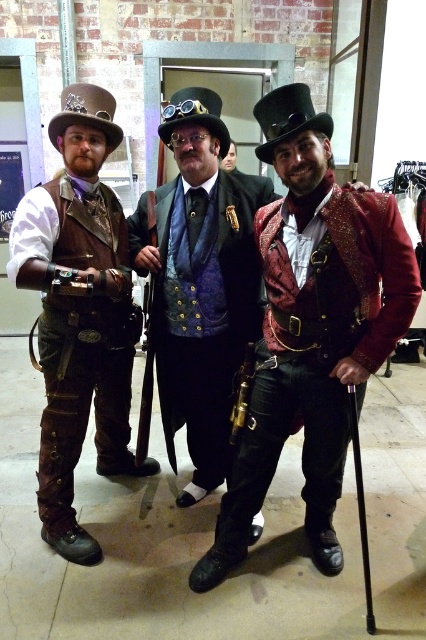
Between point (103, 436) and point (146, 243), which one is positioned behind?

The point (103, 436) is more distant.

Who is taller, leather vest at left or velvet blue vest at center?

leather vest at left is taller.

Image resolution: width=426 pixels, height=640 pixels. Identify the location of leather vest at left. (78, 312).

Can you confirm if shiny red velvet jacket at center is positioned to the right of velvet blue vest at center?

Yes, shiny red velvet jacket at center is to the right of velvet blue vest at center.

Between point (250, 400) and point (169, 394), which one is positioned behind?

The point (169, 394) is more distant.

Between point (279, 292) and point (236, 266), which one is positioned behind?

The point (236, 266) is more distant.

At what (x,y) coordinates should I click in order to perform the action: click on shiny red velvet jacket at center. Please return your answer as a coordinate pair (x, y). This screenshot has width=426, height=640. Looking at the image, I should click on (311, 326).

Between point (302, 413) and point (57, 205), which one is positioned behind?

Positioned behind is point (302, 413).

Between shiny red velvet jacket at center and leather vest at left, which one is positioned higher?

leather vest at left is above.

You are a GUI agent. You are given a task and a screenshot of the screen. Output one action in this format:
    pyautogui.click(x=<x>, y=<y>)
    Task: Click on the shiny red velvet jacket at center
    This screenshot has width=426, height=640.
    Given the screenshot: What is the action you would take?
    pyautogui.click(x=311, y=326)